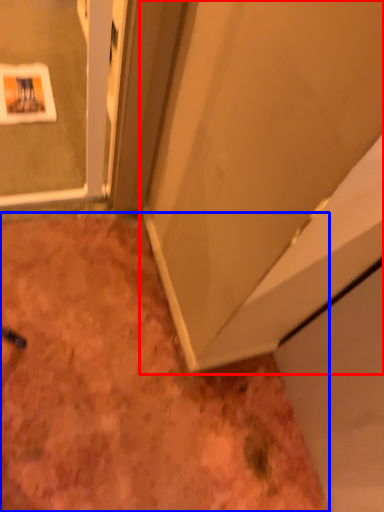
Question: Which object is closer to the camera taking this photo, door (highlighted by a red box) or dirt (highlighted by a blue box)?

Choices:
 (A) door
 (B) dirt

Answer: (A)